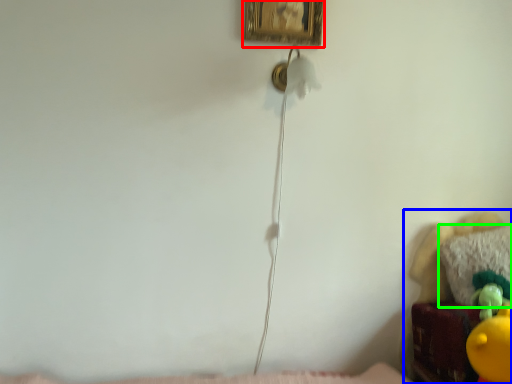
Question: Which object is positioned closest to picture frame (highlighted by a red box)? Select from furniture (highlighted by a blue box) and pillow (highlighted by a green box).

Choices:
 (A) furniture
 (B) pillow

Answer: (A)